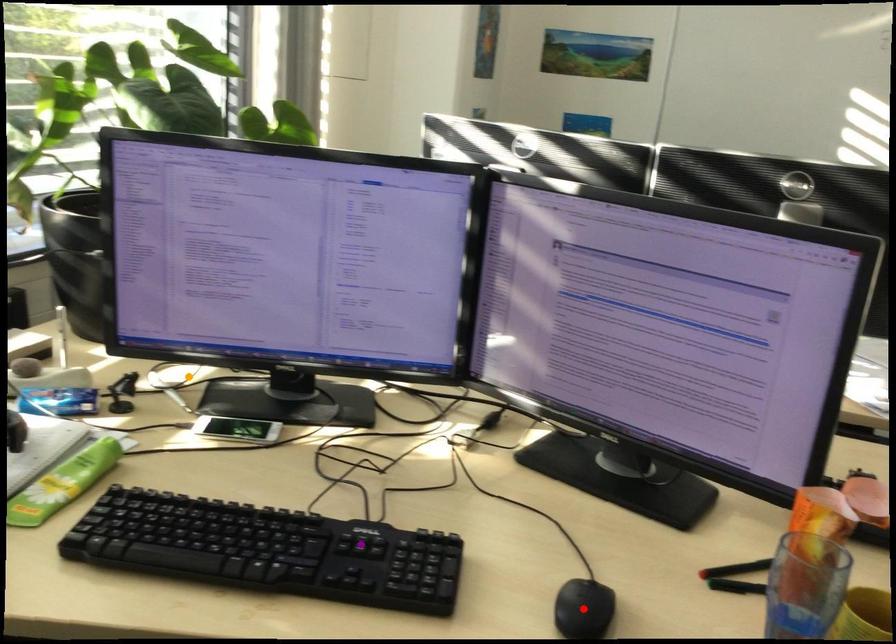
Order these from farthest to nearest:
1. orange point
2. red point
3. purple point

orange point < purple point < red point